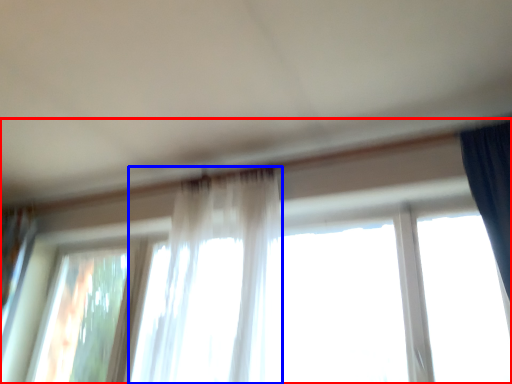
Question: Which point is further to the camera, window (highlighted by a red box) or curtain (highlighted by a blue box)?

Choices:
 (A) window
 (B) curtain

Answer: (A)